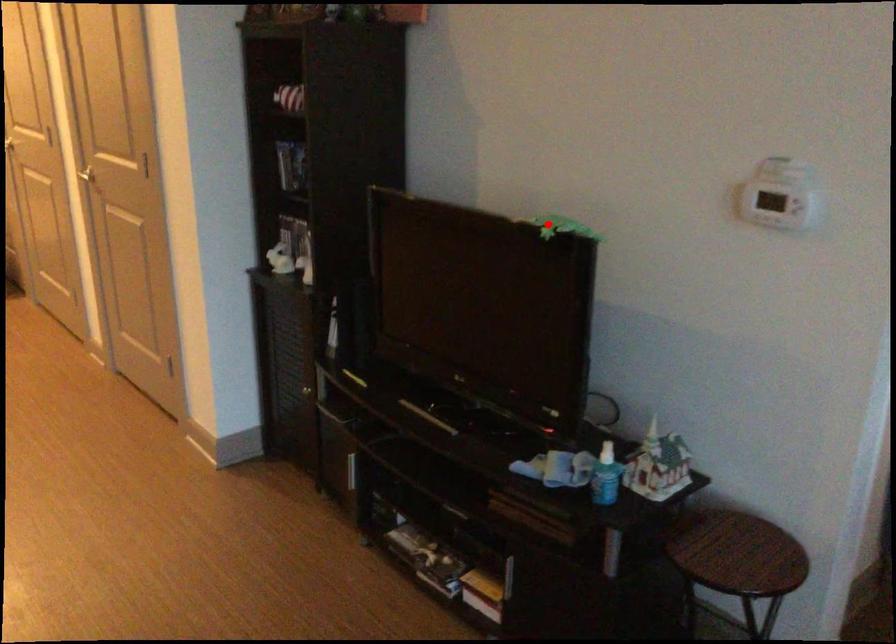
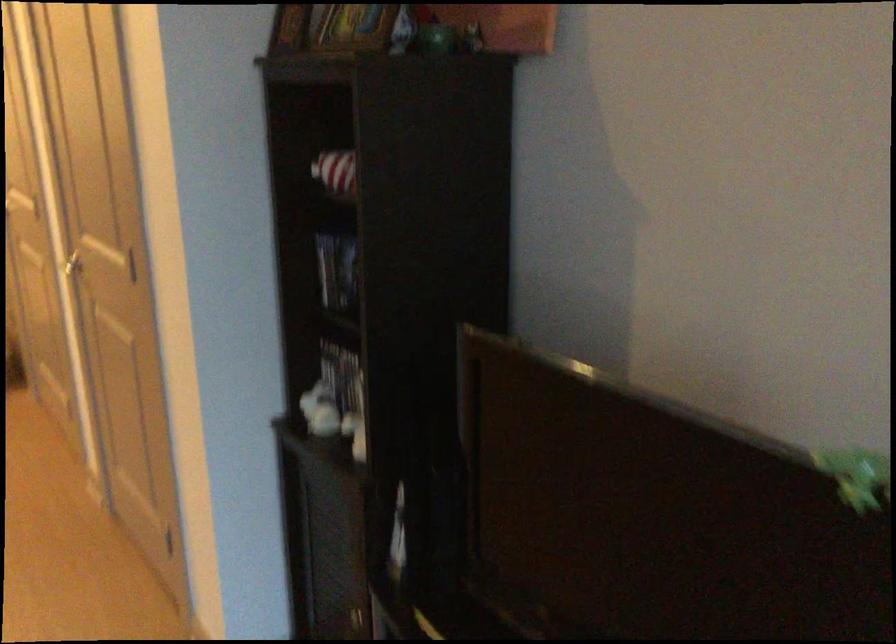
Where in the second image is the point corresponding to the highlighted location from the first image?

(857, 476)